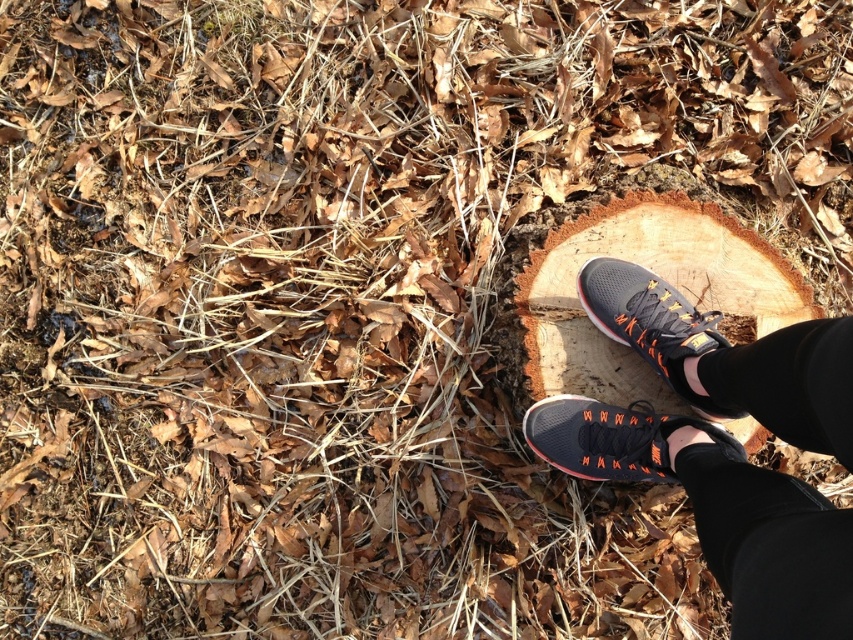
Question: Is orange mesh sneaker at lower right positioned before matte black sneaker at center?

Choices:
 (A) yes
 (B) no

Answer: (A)

Question: Is matte black sneakers at center below matte black sneaker at center?

Choices:
 (A) yes
 (B) no

Answer: (A)

Question: Which point is farther to the camera?

Choices:
 (A) matte black sneaker at center
 (B) orange mesh sneaker at lower right

Answer: (A)

Question: Among these objects, which one is nearest to the camera?

Choices:
 (A) matte black sneaker at center
 (B) orange mesh sneaker at lower right
 (C) wooden stump at center

Answer: (B)

Question: Which point is farther to the camera?

Choices:
 (A) wooden stump at center
 (B) matte black sneakers at center

Answer: (A)

Question: Is wooden stump at center bigger than orange mesh sneaker at lower right?

Choices:
 (A) yes
 (B) no

Answer: (A)